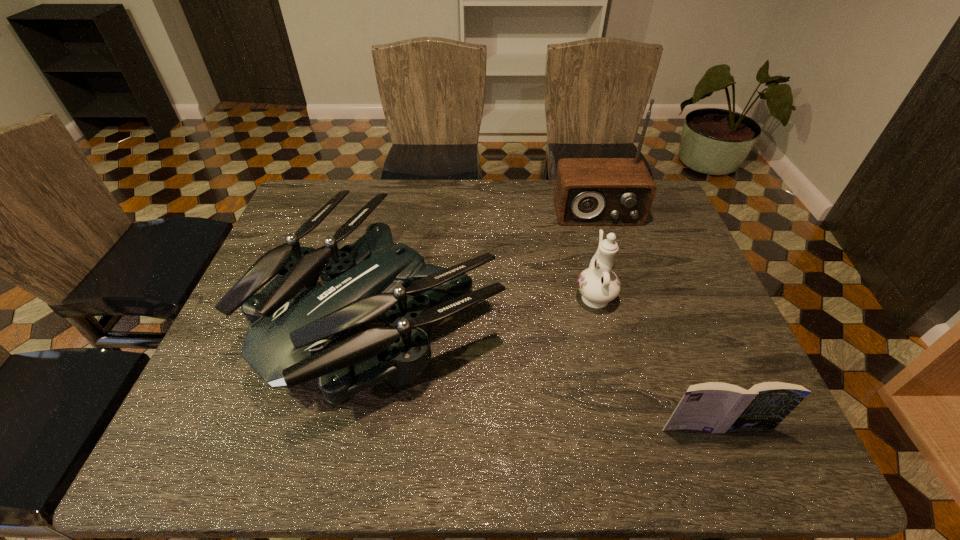
Locate an element on the screen. This screenshot has height=540, width=960. free spot at the near edge of the desktop is located at coordinates (305, 435).

This screenshot has width=960, height=540. What are the coordinates of `vacant area at the right edge of the desktop` in the screenshot? It's located at (653, 286).

This screenshot has height=540, width=960. In the image, there is a desktop. What are the coordinates of `vacant space at the far left corner` in the screenshot? It's located at (338, 207).

At what (x,y) coordinates should I click in order to perform the action: click on free area in between the book and the tallest object. Please return your answer as a coordinate pair (x, y). This screenshot has width=960, height=540. Looking at the image, I should click on click(x=657, y=320).

Identify the location of vacant space that's between the leftmost object and the chinaware. Image resolution: width=960 pixels, height=540 pixels. (489, 306).

Where is `empty space that is in between the book and the drone`? empty space that is in between the book and the drone is located at coordinates (549, 373).

I want to click on unoccupied position between the book and the drone, so click(549, 373).

At what (x,y) coordinates should I click in order to perform the action: click on empty location between the book and the leftmost object. Please return your answer as a coordinate pair (x, y). Looking at the image, I should click on (549, 373).

The image size is (960, 540). Identify the location of blank region between the tallest object and the drone. (491, 265).

Identify the location of vacant space that's between the drone and the book. (549, 373).